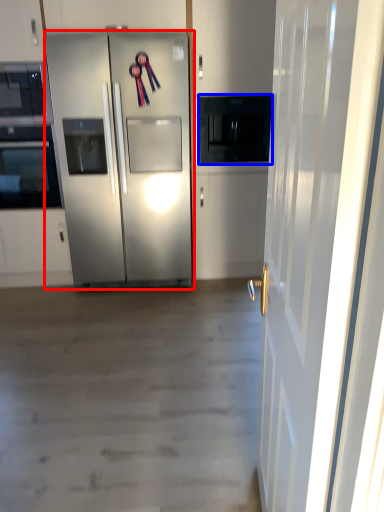
Question: Which object is closer to the camera taking this photo, refrigerator (highlighted by a red box) or appliance (highlighted by a blue box)?

Choices:
 (A) refrigerator
 (B) appliance

Answer: (A)